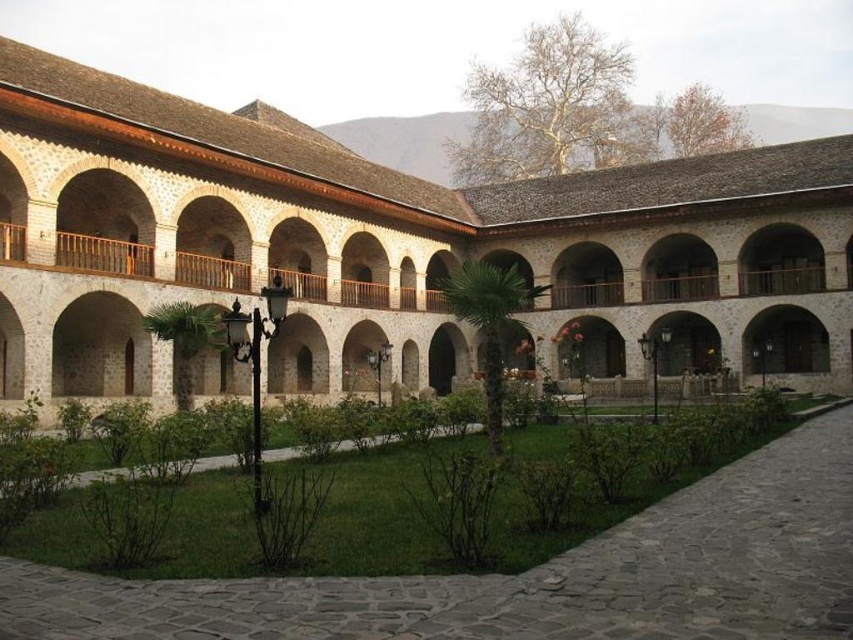
Which is below, white stone building at center or green grass at center?

green grass at center is lower down.

Is point (21, 115) positioned in front of point (45, 616)?

That is False.

Where is `white stone building at center`? The width and height of the screenshot is (853, 640). white stone building at center is located at coordinates point(381,244).